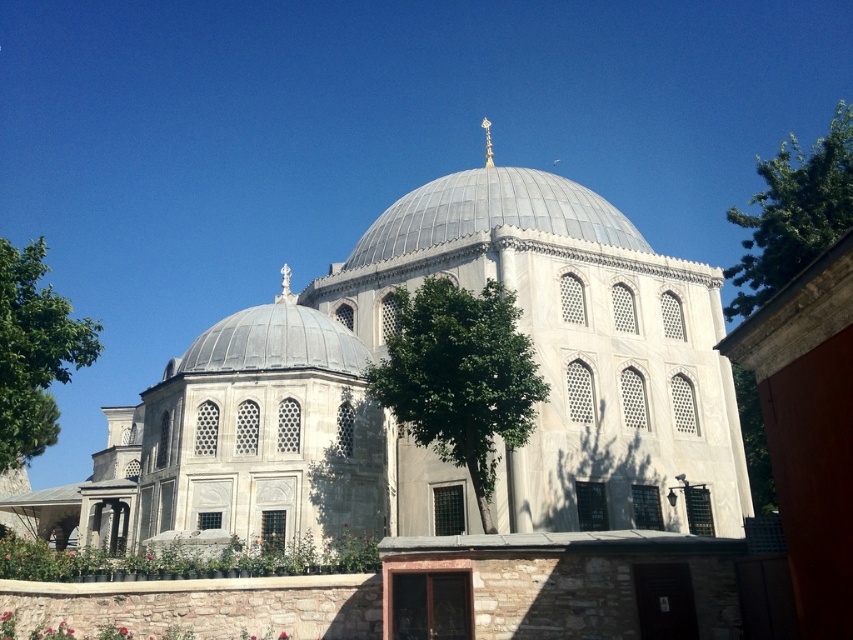
You are standing in front of the mosque and want to take a photo of the gray metallic dome at center without any obstructions. Is the green leafy tree at upper right blocking your view of the dome?

The gray metallic dome at center is below the green leafy tree at upper right, so the tree is blocking the view of the dome from your current position. Move to a different angle to capture the dome without obstruction.

You are standing at the entrance of the grand mosque and see two points marked on the facade. The first point is at coordinates point (752, 260) and the second is at point (260, 337). Which point is closer to the entrance?

Point (260, 337) is closer to the entrance because it is in front of point (752, 260), which is behind it.

You are standing in front of the mosque and want to take a photo that includes both the green leafy tree at upper right and the central dome. Given that the central dome is closer to you than the tree, will the tree appear smaller in the photo compared to the dome?

Yes, the green leafy tree at upper right is 40.40 meters from viewer, which is farther away than the central dome. Since objects farther away appear smaller, the tree will appear smaller than the dome in the photo.